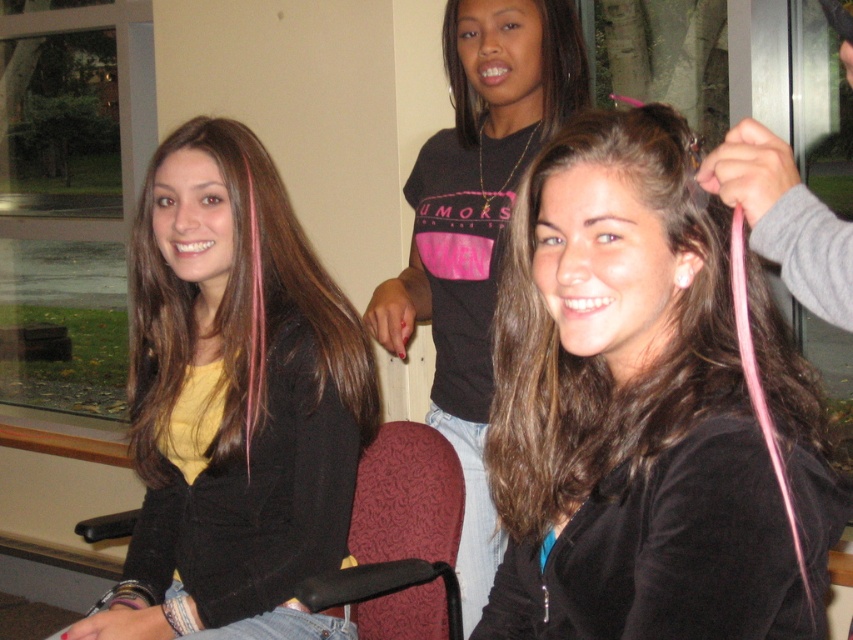
Looking at this image, is pink silky hair at center below black shiny hair at upper center?

Indeed, pink silky hair at center is positioned under black shiny hair at upper center.

Locate an element on the screen. The width and height of the screenshot is (853, 640). pink silky hair at center is located at coordinates (596, 355).

What do you see at coordinates (235, 307) in the screenshot?
I see `brownsmoothhair at left` at bounding box center [235, 307].

Find the location of a particular element. brownsmoothhair at left is located at coordinates (235, 307).

Can you confirm if maroon fabric chair at lower center is smaller than black shiny hair at upper center?

Incorrect, maroon fabric chair at lower center is not smaller in size than black shiny hair at upper center.

How much distance is there between maroon fabric chair at lower center and black shiny hair at upper center?

28.49 inches

Who is more forward, (427, 432) or (445, 60)?

Point (427, 432) is in front.

Where is `maroon fabric chair at lower center`? The height and width of the screenshot is (640, 853). maroon fabric chair at lower center is located at coordinates (407, 497).